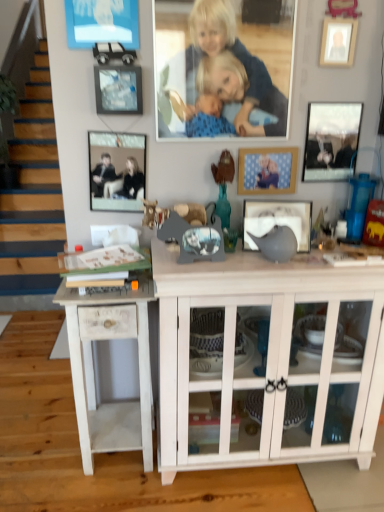
Question: Does blue fabric blanket at upper center come behind blue fabric picture frame at center, which is the third picture frame in left-to-right order?

Choices:
 (A) yes
 (B) no

Answer: (B)

Question: From the image's perspective, is blue fabric blanket at upper center located above blue fabric picture frame at center, which is the third picture frame in left-to-right order?

Choices:
 (A) yes
 (B) no

Answer: (A)

Question: Is blue fabric blanket at upper center at the right side of blue fabric picture frame at center, which is the third picture frame in left-to-right order?

Choices:
 (A) no
 (B) yes

Answer: (A)

Question: From a real-world perspective, does blue fabric blanket at upper center sit lower than blue fabric picture frame at center, which is the third picture frame in left-to-right order?

Choices:
 (A) no
 (B) yes

Answer: (A)

Question: Can you confirm if blue fabric blanket at upper center is shorter than blue fabric picture frame at center, which is the third picture frame in left-to-right order?

Choices:
 (A) yes
 (B) no

Answer: (B)

Question: Considering the relative positions of blue fabric blanket at upper center and blue fabric picture frame at center, which is the third picture frame in left-to-right order, in the image provided, is blue fabric blanket at upper center to the left or to the right of blue fabric picture frame at center, which is the third picture frame in left-to-right order,?

Choices:
 (A) left
 (B) right

Answer: (A)

Question: Looking at the image, does blue fabric blanket at upper center seem bigger or smaller compared to blue fabric picture frame at center, which ranks as the 4th picture frame in right-to-left order?

Choices:
 (A) small
 (B) big

Answer: (B)

Question: Relative to blue fabric picture frame at center, which is the third picture frame in left-to-right order, is blue fabric blanket at upper center in front or behind?

Choices:
 (A) front
 (B) behind

Answer: (A)

Question: Is blue fabric blanket at upper center spatially inside blue fabric picture frame at center, which is the third picture frame in left-to-right order, or outside of it?

Choices:
 (A) outside
 (B) inside

Answer: (A)

Question: In the image, is white wood side table at lower left on the left side or the right side of metallic silver picture frame at upper left, the sixth picture frame from the right?

Choices:
 (A) left
 (B) right

Answer: (A)

Question: Is white wood side table at lower left inside or outside of metallic silver picture frame at upper left, which ranks as the first picture frame in left-to-right order?

Choices:
 (A) outside
 (B) inside

Answer: (A)

Question: Considering the positions of point (87, 473) and point (130, 193), is point (87, 473) closer or farther from the camera than point (130, 193)?

Choices:
 (A) closer
 (B) farther

Answer: (B)

Question: Is white wood side table at lower left wider or thinner than metallic silver picture frame at upper left, the sixth picture frame from the right?

Choices:
 (A) wide
 (B) thin

Answer: (A)

Question: Is point click(x=104, y=101) closer or farther from the camera than point click(x=148, y=458)?

Choices:
 (A) closer
 (B) farther

Answer: (A)

Question: In the image, is metallic silver picture frame at upper left, which appears as the 5th picture frame when viewed from the right, positioned in front of or behind white wood side table at lower left?

Choices:
 (A) behind
 (B) front

Answer: (A)